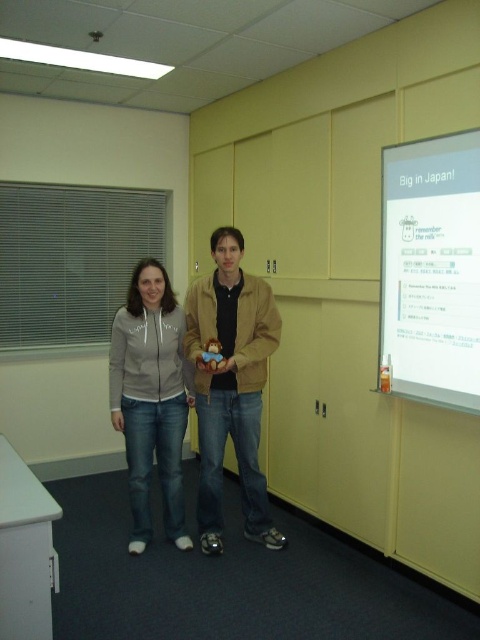
Which is more to the right, white matte projection screen at upper right or matte gray hoodie at center?

From the viewer's perspective, white matte projection screen at upper right appears more on the right side.

Is point (399, 371) farther from viewer compared to point (153, 364)?

No, (399, 371) is in front of (153, 364).

This screenshot has height=640, width=480. Describe the element at coordinates (431, 269) in the screenshot. I see `white matte projection screen at upper right` at that location.

Locate an element on the screen. The height and width of the screenshot is (640, 480). white matte projection screen at upper right is located at coordinates (431, 269).

Between matte beige hoodie at center and matte gray hoodie at center, which one appears on the left side from the viewer's perspective?

matte gray hoodie at center

Who is shorter, matte beige hoodie at center or matte gray hoodie at center?

matte gray hoodie at center is shorter.

This screenshot has height=640, width=480. What do you see at coordinates (230, 385) in the screenshot? I see `matte beige hoodie at center` at bounding box center [230, 385].

Locate an element on the screen. The height and width of the screenshot is (640, 480). matte beige hoodie at center is located at coordinates (230, 385).

Who is more distant from viewer, [463,333] or [124,426]?

The point [124,426] is behind.

Is white matte projection screen at upper right to the left of matte beige hoodie at center from the viewer's perspective?

Answer: No, white matte projection screen at upper right is not to the left of matte beige hoodie at center.

Image resolution: width=480 pixels, height=640 pixels. Describe the element at coordinates (431, 269) in the screenshot. I see `white matte projection screen at upper right` at that location.

Where is `white matte projection screen at upper right`? This screenshot has height=640, width=480. white matte projection screen at upper right is located at coordinates (431, 269).